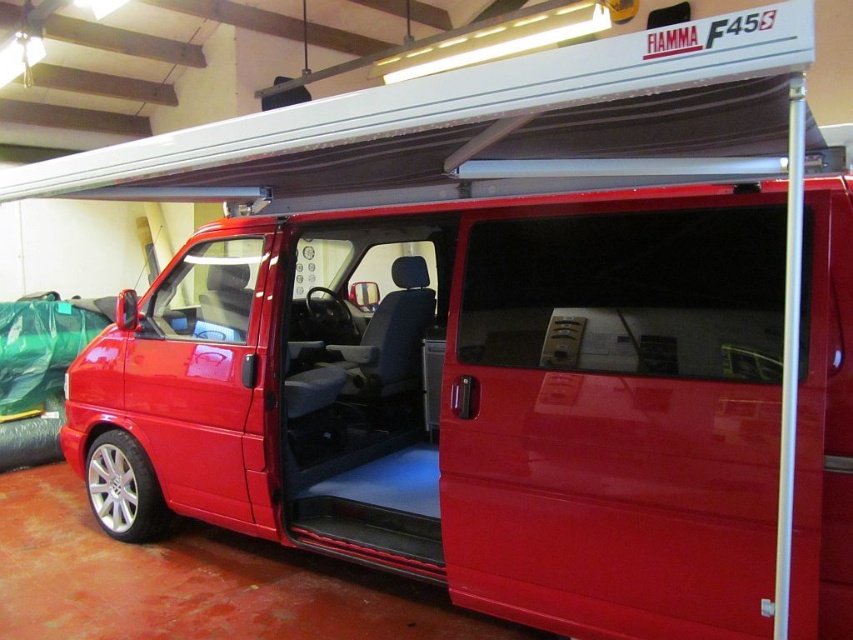
Question: Which of the following is the farthest from the observer?

Choices:
 (A) glossy red van at center
 (B) glossy plastic door at center

Answer: (B)

Question: Which point is farther to the camera?

Choices:
 (A) [410, 273]
 (B) [294, 515]

Answer: (A)

Question: Is glossy red van at center above glossy plastic door at center?

Choices:
 (A) no
 (B) yes

Answer: (A)

Question: Observing the image, what is the correct spatial positioning of glossy red van at center in reference to glossy plastic door at center?

Choices:
 (A) below
 (B) above

Answer: (A)

Question: Which object appears closest to the camera in this image?

Choices:
 (A) glossy plastic door at center
 (B) glossy red van at center

Answer: (B)

Question: Can you confirm if glossy red van at center is positioned to the left of glossy plastic door at center?

Choices:
 (A) no
 (B) yes

Answer: (A)